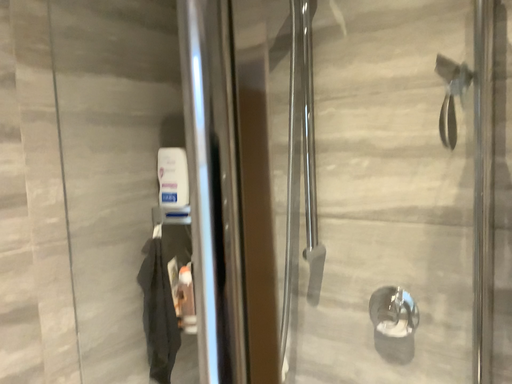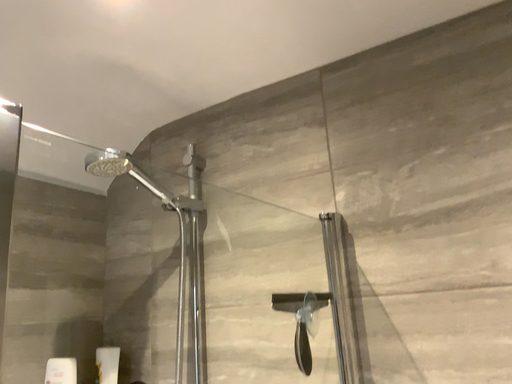
Question: How did the camera likely rotate when shooting the video?

Choices:
 (A) rotated upward
 (B) rotated downward

Answer: (A)